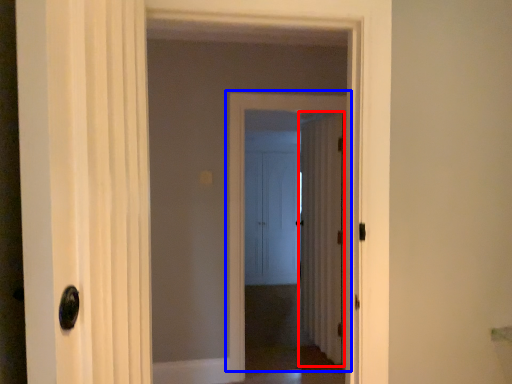
Question: Among these objects, which one is nearest to the camera, door (highlighted by a red box) or door (highlighted by a blue box)?

Choices:
 (A) door
 (B) door

Answer: (B)